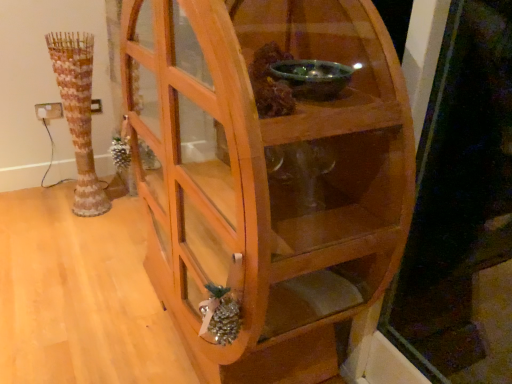
Question: Considering the relative sizes of wooden textured vase at left and wooden cabinet at center in the image provided, is wooden textured vase at left bigger than wooden cabinet at center?

Choices:
 (A) no
 (B) yes

Answer: (A)

Question: Considering the relative sizes of wooden textured vase at left and wooden cabinet at center in the image provided, is wooden textured vase at left thinner than wooden cabinet at center?

Choices:
 (A) no
 (B) yes

Answer: (B)

Question: Does wooden textured vase at left have a greater width compared to wooden cabinet at center?

Choices:
 (A) yes
 (B) no

Answer: (B)

Question: From the image's perspective, is wooden textured vase at left above wooden cabinet at center?

Choices:
 (A) no
 (B) yes

Answer: (B)

Question: Is wooden textured vase at left not inside wooden cabinet at center?

Choices:
 (A) yes
 (B) no

Answer: (A)

Question: Would you say wooden textured vase at left is a long distance from wooden cabinet at center?

Choices:
 (A) no
 (B) yes

Answer: (B)

Question: Is wooden cabinet at center not within wooden textured vase at left?

Choices:
 (A) no
 (B) yes

Answer: (B)

Question: Is wooden cabinet at center facing away from wooden textured vase at left?

Choices:
 (A) no
 (B) yes

Answer: (A)

Question: Can you confirm if wooden cabinet at center is positioned to the right of wooden textured vase at left?

Choices:
 (A) no
 (B) yes

Answer: (B)

Question: Are wooden cabinet at center and wooden textured vase at left located far from each other?

Choices:
 (A) no
 (B) yes

Answer: (B)

Question: Does wooden cabinet at center turn towards wooden textured vase at left?

Choices:
 (A) no
 (B) yes

Answer: (A)

Question: From the image's perspective, would you say wooden cabinet at center is shown under wooden textured vase at left?

Choices:
 (A) no
 (B) yes

Answer: (B)

Question: Is point (137, 157) closer or farther from the camera than point (75, 74)?

Choices:
 (A) farther
 (B) closer

Answer: (B)